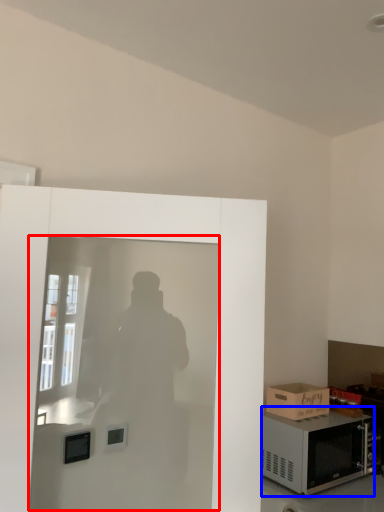
Question: Which object is further to the camera taking this photo, screen door (highlighted by a red box) or microwave oven (highlighted by a blue box)?

Choices:
 (A) screen door
 (B) microwave oven

Answer: (B)